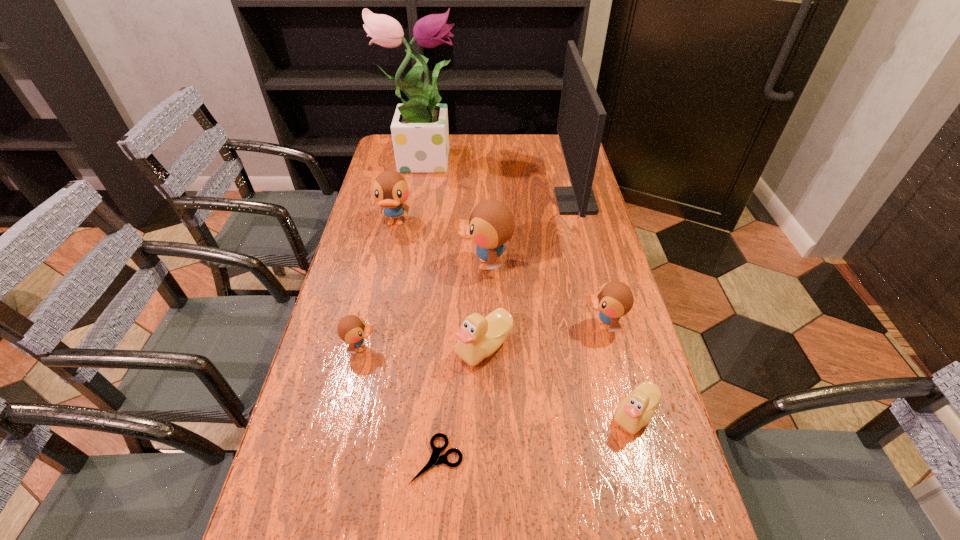
Where is `object that ranks as the third closest to the smallest blue duck`? This screenshot has height=540, width=960. object that ranks as the third closest to the smallest blue duck is located at coordinates (491, 224).

Point out which object is positioned as the eighth nearest to the left beige duck. Please provide its 2D coordinates. Your answer should be formatted as a tuple, i.e. [(x, y)], where the tuple contains the x and y coordinates of a point satisfying the conditions above.

[(420, 134)]

Identify the location of the fifth closest duck to the fourth tallest object. (635, 411).

Locate which duck is the closest to the tallest object. Please provide its 2D coordinates. Your answer should be formatted as a tuple, i.e. [(x, y)], where the tuple contains the x and y coordinates of a point satisfying the conditions above.

[(390, 189)]

At what (x,y) coordinates should I click in order to perform the action: click on blue duck that is the second closest one to the rightmost blue duck. Please return your answer as a coordinate pair (x, y). The height and width of the screenshot is (540, 960). Looking at the image, I should click on (352, 329).

Select which blue duck is the third closest to the farther beige duck. Please provide its 2D coordinates. Your answer should be formatted as a tuple, i.e. [(x, y)], where the tuple contains the x and y coordinates of a point satisfying the conditions above.

[(352, 329)]

The height and width of the screenshot is (540, 960). Find the location of `vacant space that satisfies the following two spatial constraints: 1. on the front-facing side of the shears; 2. on the right side of the second tallest duck`. vacant space that satisfies the following two spatial constraints: 1. on the front-facing side of the shears; 2. on the right side of the second tallest duck is located at coordinates (344, 459).

Where is `free space that satisfies the following two spatial constraints: 1. at the beak of the nearer beige duck; 2. on the front side of the shears`? free space that satisfies the following two spatial constraints: 1. at the beak of the nearer beige duck; 2. on the front side of the shears is located at coordinates click(647, 459).

In order to click on vacant space that satisfies the following two spatial constraints: 1. on the front-facing side of the shears; 2. on the right side of the smallest blue duck in this screenshot , I will do `click(335, 459)`.